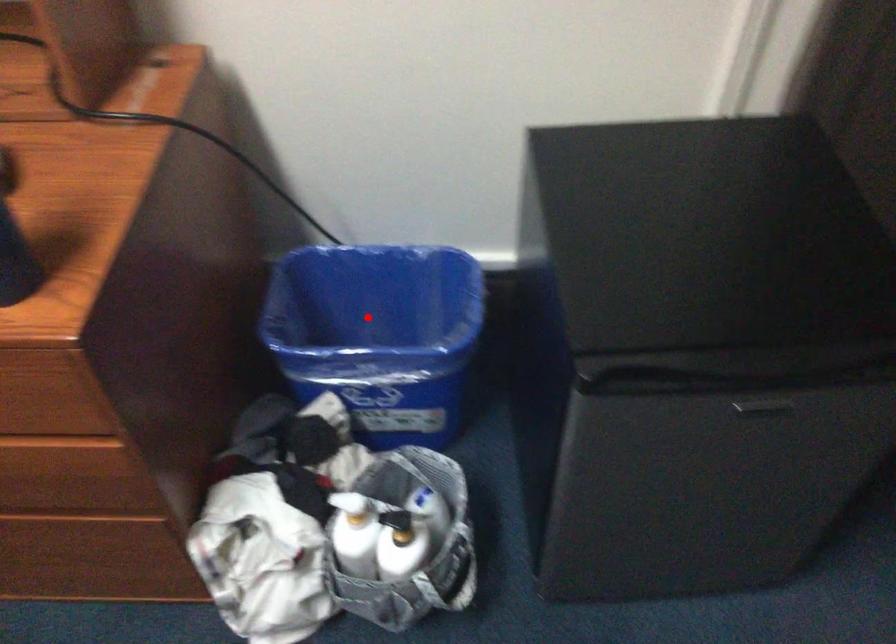
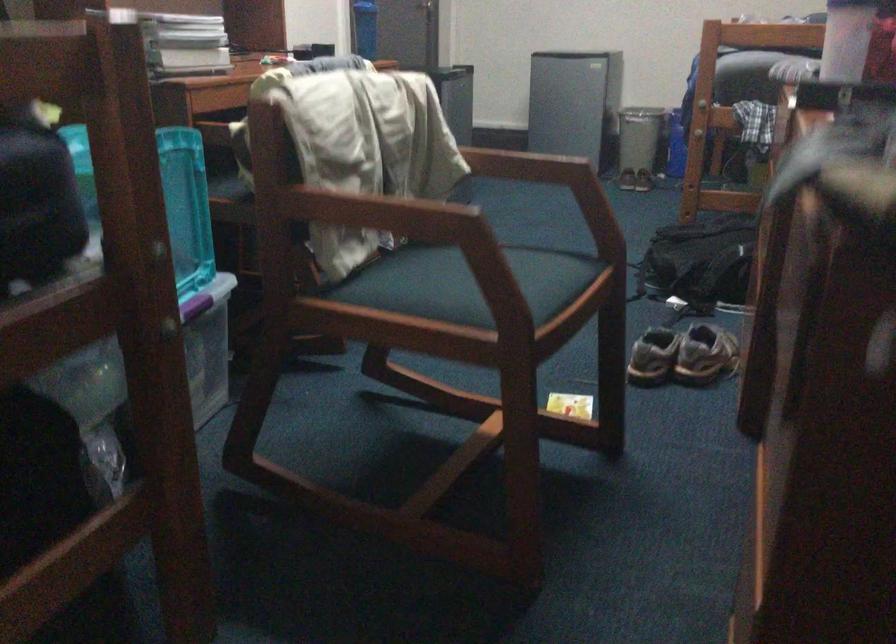
Question: I am providing you with two images of the same scene from different viewpoints. A red point is marked on the first image. Can you still see the location of the red point in image 2?

Choices:
 (A) Yes
 (B) No

Answer: (B)